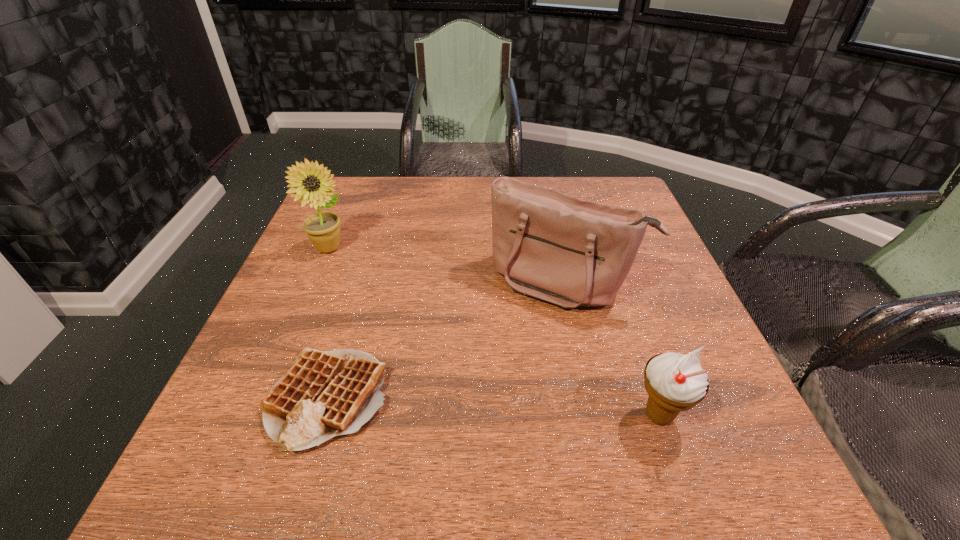
I want to click on free space located 0.390m on the face of the sunflower, so click(x=453, y=341).

At what (x,y) coordinates should I click in order to perform the action: click on vacant space located on the face of the sunflower. Please return your answer as a coordinate pair (x, y). Looking at the image, I should click on tap(402, 302).

Where is `waffle that is at the near edge`? The width and height of the screenshot is (960, 540). waffle that is at the near edge is located at coordinates (325, 394).

I want to click on icecream located in the near edge section of the desktop, so click(675, 382).

Where is `waffle that is at the left edge`? waffle that is at the left edge is located at coordinates click(x=325, y=394).

Image resolution: width=960 pixels, height=540 pixels. Identify the location of sunflower located in the left edge section of the desktop. (323, 229).

This screenshot has height=540, width=960. I want to click on icecream located in the right edge section of the desktop, so click(x=675, y=382).

This screenshot has width=960, height=540. Find the location of `shoulder bag present at the right edge`. shoulder bag present at the right edge is located at coordinates (548, 245).

Identify the location of object that is at the near left corner. (325, 394).

The image size is (960, 540). Find the location of `object that is at the near right corner`. object that is at the near right corner is located at coordinates (675, 382).